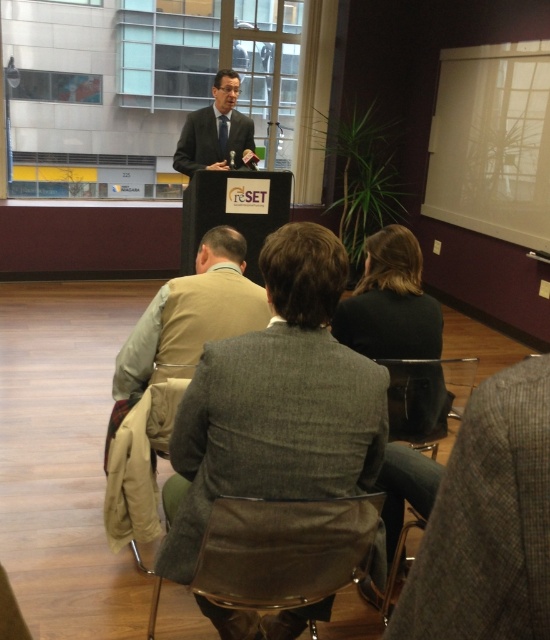
In the image, there is a point labeled at coordinates (191, 314). What object is located at this point?

The point at coordinates (191, 314) indicates a tan fabric jacket at center.